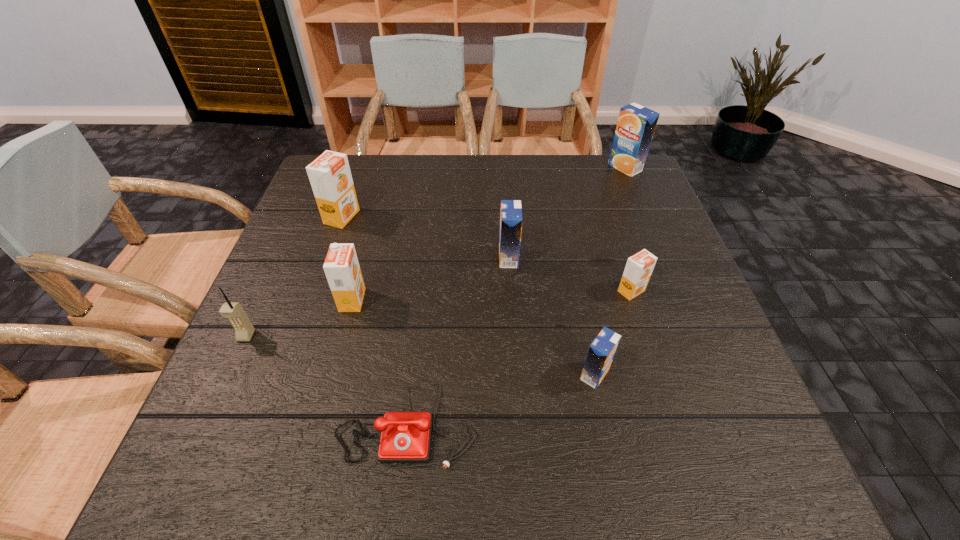
You are a GUI agent. You are given a task and a screenshot of the screen. Output one action in this format:
    pyautogui.click(x=<x>, y=<y>)
    Task: Click on the smallest blue orange_juice
    
    Given the screenshot: What is the action you would take?
    pyautogui.click(x=601, y=352)

In order to click on the third object from right to left in this screenshot , I will do (601, 352).

The height and width of the screenshot is (540, 960). Find the location of `the fifth orange juice from left to right`. the fifth orange juice from left to right is located at coordinates (639, 267).

The height and width of the screenshot is (540, 960). In order to click on the rightmost orange orange juice in this screenshot , I will do `click(639, 267)`.

Where is `the shortest object`? The width and height of the screenshot is (960, 540). the shortest object is located at coordinates (405, 437).

Identify the location of the fifth object from right to left. The height and width of the screenshot is (540, 960). (405, 437).

Where is `vacant space located on the front of the farthest object`? The width and height of the screenshot is (960, 540). vacant space located on the front of the farthest object is located at coordinates (658, 245).

Find the location of a particular element. The width and height of the screenshot is (960, 540). vacant space located on the front of the biggest orange orange juice is located at coordinates (329, 253).

Identify the location of vacant space situated on the front of the cellular telephone, where the keypad is located. (195, 450).

You are a GUI agent. You are given a task and a screenshot of the screen. Output one action in this format:
    pyautogui.click(x=<x>, y=<y>)
    Task: Click on the vacant space located 0.080m on the back of the leftmost blue orange_juice
    
    Given the screenshot: What is the action you would take?
    pyautogui.click(x=507, y=227)